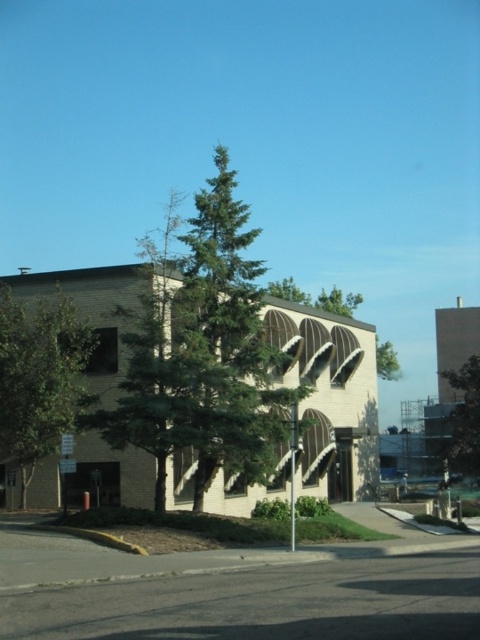
What do you see at coordinates (39, 378) in the screenshot?
I see `green leafy tree at left` at bounding box center [39, 378].

Between green leafy tree at left and green leafy tree at center, which one has less height?

With less height is green leafy tree at center.

Locate an element on the screen. Image resolution: width=480 pixels, height=640 pixels. green leafy tree at left is located at coordinates (x=39, y=378).